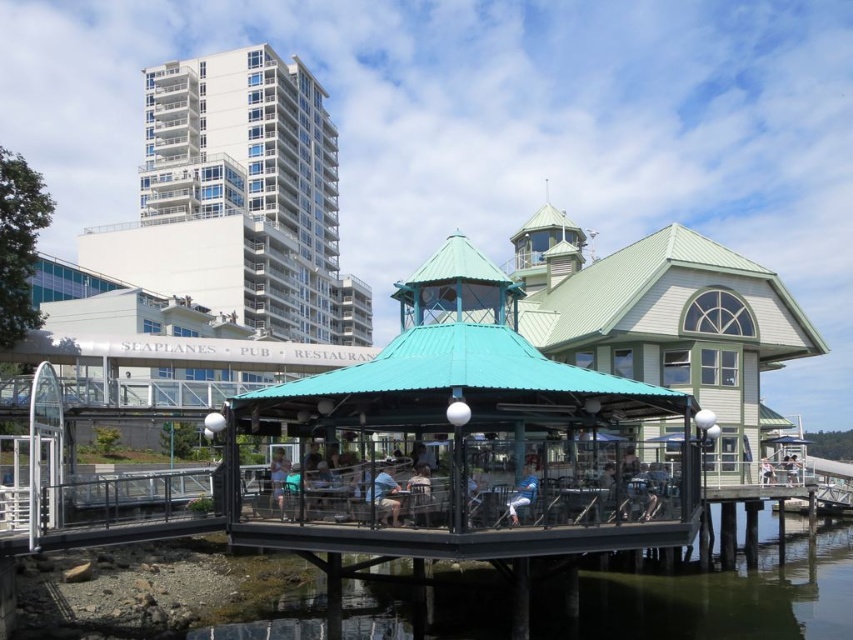
Question: Which object is the farthest from the light blue fabric umbrella at center?

Choices:
 (A) clear water at lower center
 (B) light blue fabric jacket at center

Answer: (A)

Question: Which of the following is the farthest from the observer?

Choices:
 (A) light blue fabric shirt at center
 (B) light blue fabric jacket at center

Answer: (B)

Question: Can you confirm if blue denim jeans at lower center is bigger than light blue fabric umbrella at center?

Choices:
 (A) yes
 (B) no

Answer: (B)

Question: In this image, where is clear water at lower center located relative to light blue fabric umbrella at center?

Choices:
 (A) below
 (B) above

Answer: (A)

Question: From the image, what is the correct spatial relationship of clear water at lower center in relation to light blue fabric shirt at center?

Choices:
 (A) left
 (B) right

Answer: (B)

Question: Based on their relative distances, which object is nearer to the teal metal gazebo at center?

Choices:
 (A) light blue fabric umbrella at center
 (B) clear water at lower center
 (C) blue denim jeans at lower center

Answer: (C)